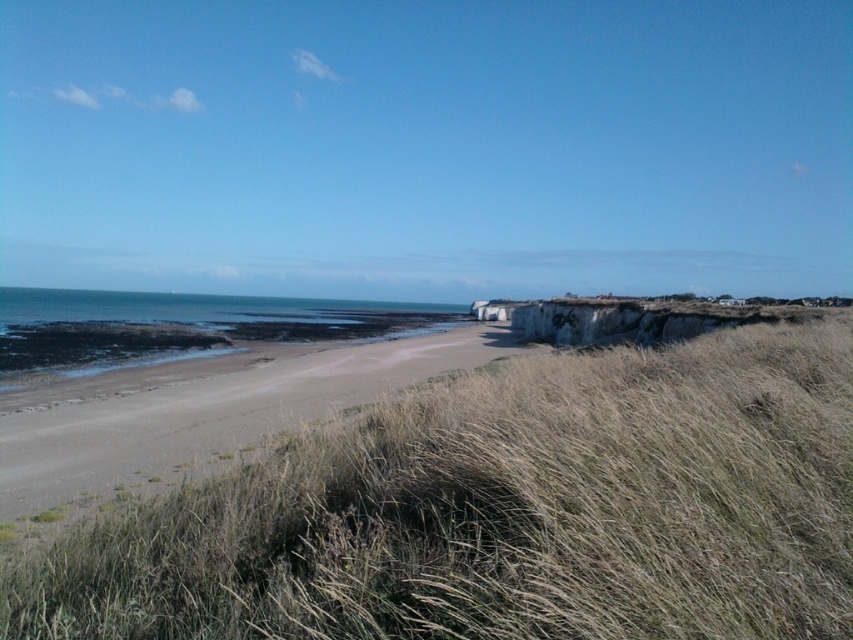
Can you confirm if brown sandy beach at center is positioned to the right of blue water at lower left?

Indeed, brown sandy beach at center is positioned on the right side of blue water at lower left.

Which of these two, brown sandy beach at center or blue water at lower left, stands shorter?

Standing shorter between the two is brown sandy beach at center.

Does point (398, 355) come closer to viewer compared to point (135, 312)?

Yes, it is.

Find the location of a particular element. brown sandy beach at center is located at coordinates (202, 412).

Does brown sandy beach at center have a smaller size compared to white stone cliff at right?

Correct, brown sandy beach at center occupies less space than white stone cliff at right.

Based on the photo, between brown sandy beach at center and white stone cliff at right, which one is positioned lower?

Positioned lower is brown sandy beach at center.

Who is more forward, [136,388] or [572,342]?

Point [136,388]

Where is `brown sandy beach at center`? The width and height of the screenshot is (853, 640). brown sandy beach at center is located at coordinates (202, 412).

Which is more to the right, dry grass at lower right or blue water at lower left?

Positioned to the right is dry grass at lower right.

Who is more forward, [831,468] or [136,320]?

Positioned in front is point [831,468].

Does point (62, 632) come farther from viewer compared to point (51, 300)?

No, it is not.

The image size is (853, 640). I want to click on dry grass at lower right, so click(x=503, y=512).